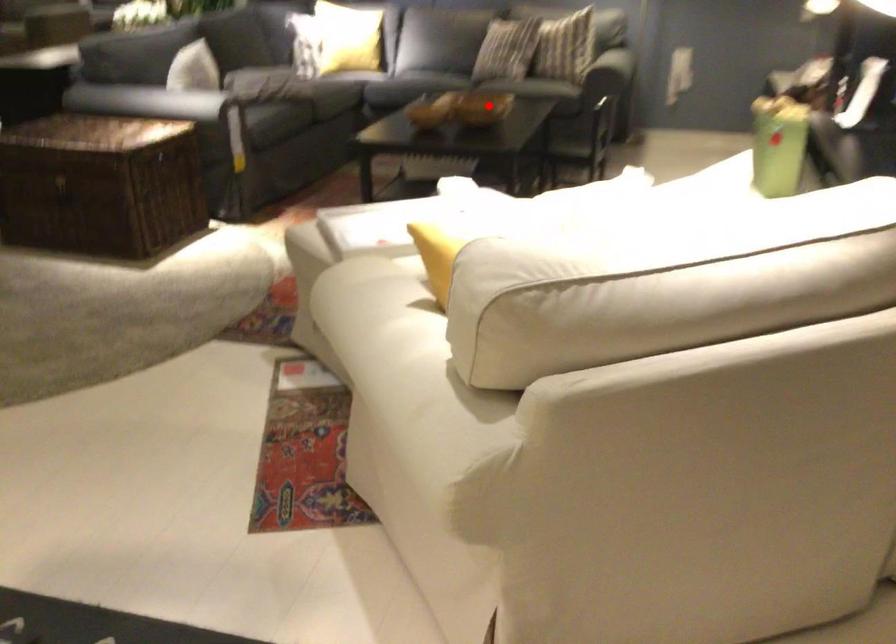
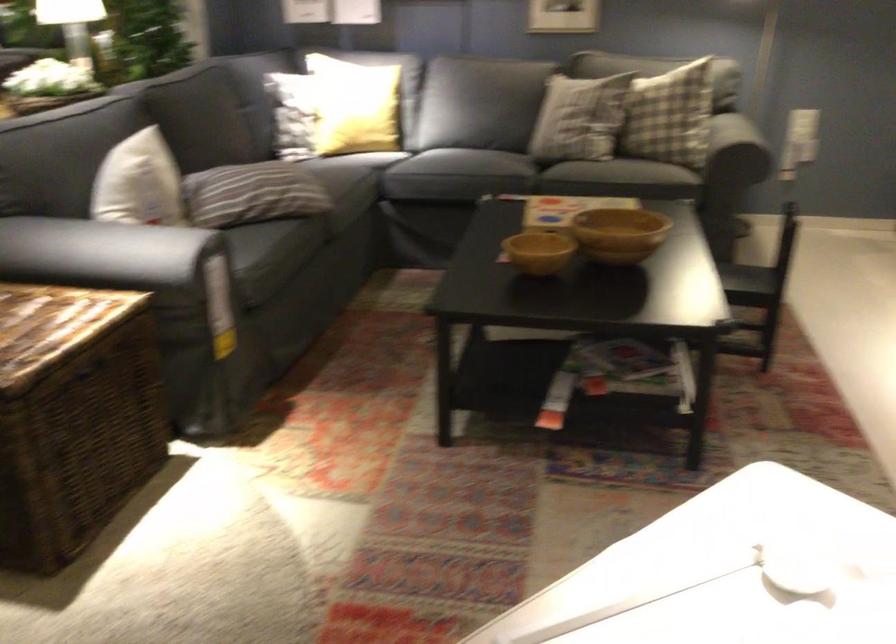
Find the pixel in the second image that matches the highlighted location in the first image.

(618, 234)